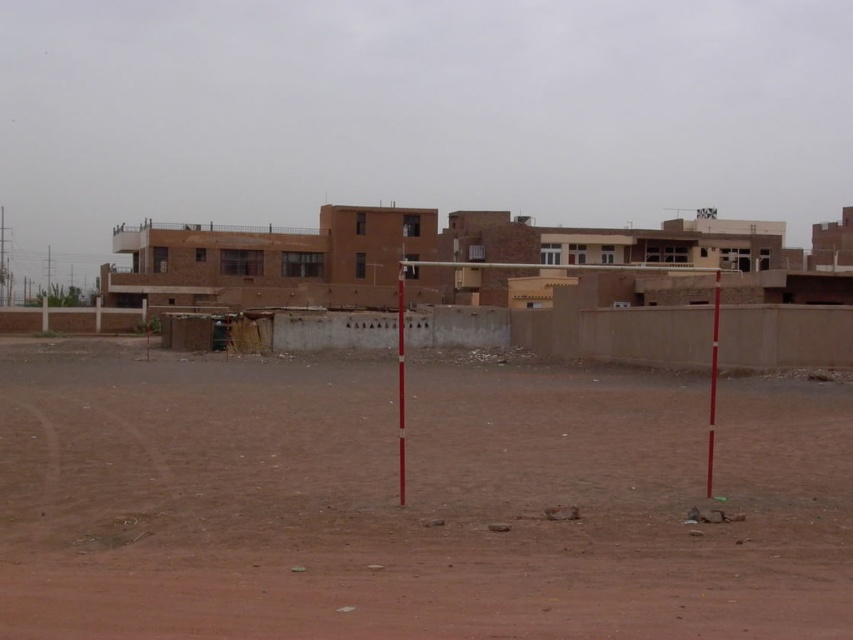
You are standing at the point closest to the camera in the image, which is either point A or point B. The coordinates of point A are point A at (403,349) and point B are point B at (711,378). Which point are you standing at?

You are standing at point A at (403,349) because it is closer to the viewer compared to point B at (711,378).